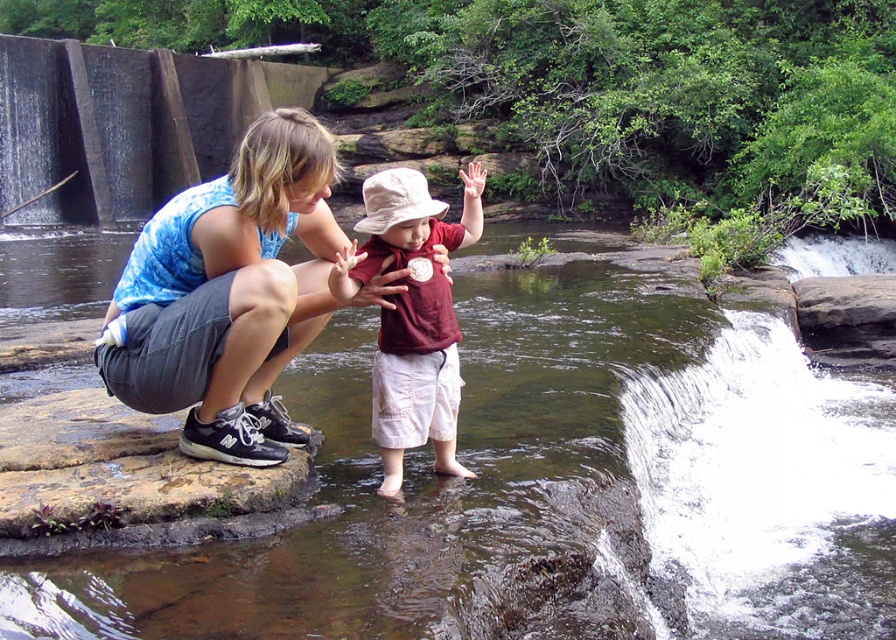
Question: In this image, where is white frothy water at lower right located relative to blue tie-dye tank top at center?

Choices:
 (A) right
 (B) left

Answer: (A)

Question: Which object is closer to the camera taking this photo?

Choices:
 (A) white frothy water at lower right
 (B) matte brown hat at center

Answer: (B)

Question: Considering the relative positions of clear water at creek center and blue tie-dye tank top at center in the image provided, where is clear water at creek center located with respect to blue tie-dye tank top at center?

Choices:
 (A) left
 (B) right

Answer: (B)

Question: Based on their relative distances, which object is farther from the clear water at creek center?

Choices:
 (A) white frothy water at lower right
 (B) blue tie-dye tank top at center
 (C) matte brown hat at center

Answer: (B)

Question: Which of the following is the closest to the observer?

Choices:
 (A) (378, 404)
 (B) (152, 253)
 (C) (638, 484)

Answer: (B)

Question: Considering the relative positions of clear water at creek center and white frothy water at lower right in the image provided, where is clear water at creek center located with respect to white frothy water at lower right?

Choices:
 (A) left
 (B) right

Answer: (A)